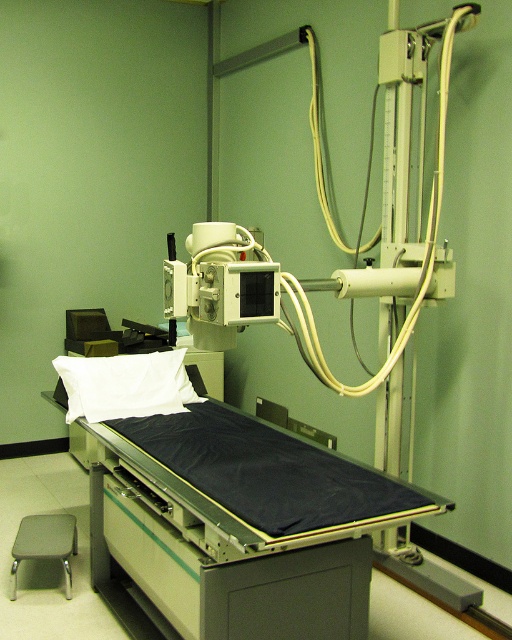
Consider the image. Can you confirm if white soft pillow at center is thinner than gray fabric stool at lower left?

In fact, white soft pillow at center might be wider than gray fabric stool at lower left.

Who is more distant from viewer, (106, 406) or (23, 525)?

The point (23, 525) is more distant.

Where is `white soft pillow at center`? white soft pillow at center is located at coordinates (124, 385).

Image resolution: width=512 pixels, height=640 pixels. What are the coordinates of `white soft pillow at center` in the screenshot? It's located at (124, 385).

Does black matte bed at center have a greater width compared to white soft pillow at center?

Correct, the width of black matte bed at center exceeds that of white soft pillow at center.

Measure the distance between black matte bed at center and camera.

1.73 meters

The image size is (512, 640). Identify the location of black matte bed at center. (233, 548).

Which is more to the left, black matte bed at center or gray fabric stool at lower left?

Positioned to the left is gray fabric stool at lower left.

Who is taller, black matte bed at center or gray fabric stool at lower left?

black matte bed at center is taller.

Is point (268, 428) positioned after point (15, 588)?

No, (268, 428) is in front of (15, 588).

Locate an element on the screen. black matte bed at center is located at coordinates (233, 548).